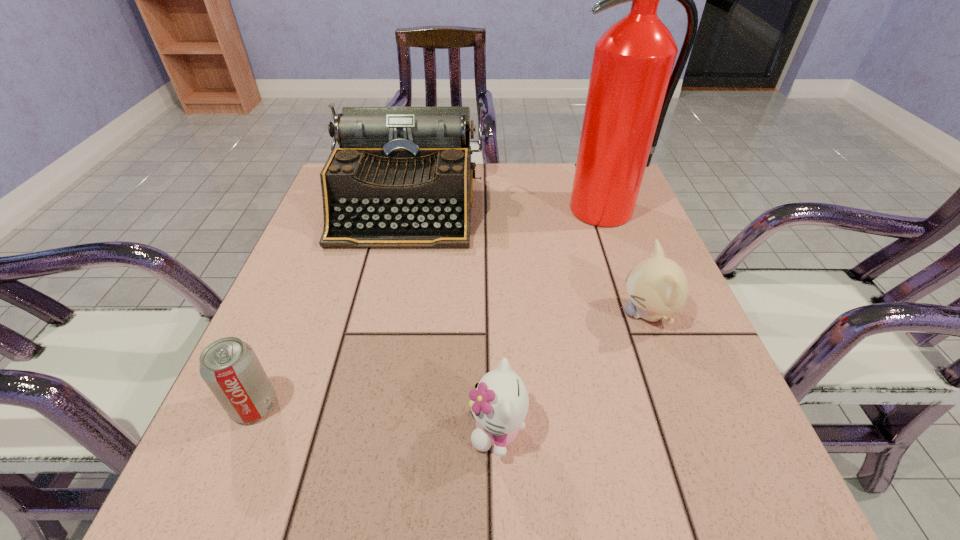
This screenshot has height=540, width=960. I want to click on object that can be found as the closest to the soda can, so click(499, 403).

Select which object appears as the closest to the nearer kitten. Please provide its 2D coordinates. Your answer should be formatted as a tuple, i.e. [(x, y)], where the tuple contains the x and y coordinates of a point satisfying the conditions above.

[(657, 286)]

Find the location of a particular element. The height and width of the screenshot is (540, 960). vacant region that satisfies the following two spatial constraints: 1. on the face of the third farthest object; 2. on the front side of the soda can is located at coordinates (681, 405).

The height and width of the screenshot is (540, 960). Find the location of `vacant space that satisfies the following two spatial constraints: 1. on the face of the right kitten; 2. on the front side of the soda can`. vacant space that satisfies the following two spatial constraints: 1. on the face of the right kitten; 2. on the front side of the soda can is located at coordinates (681, 405).